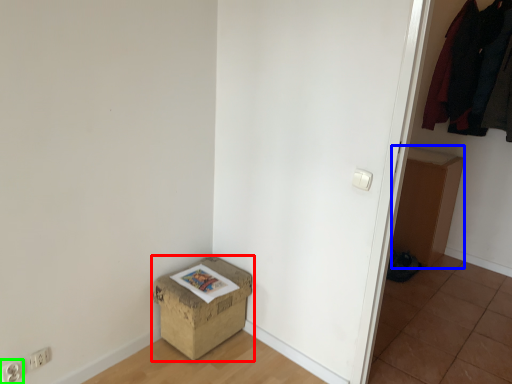
Question: Based on their relative distances, which object is farther from box (highlighted by a red box)? Choose from cardboard box (highlighted by a blue box) and electric outlet (highlighted by a green box).

Choices:
 (A) cardboard box
 (B) electric outlet

Answer: (A)